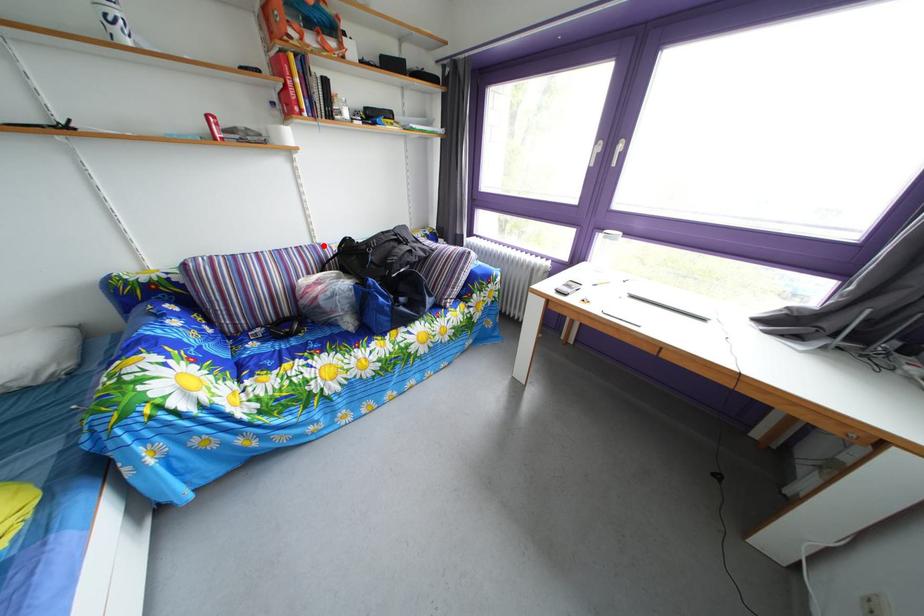
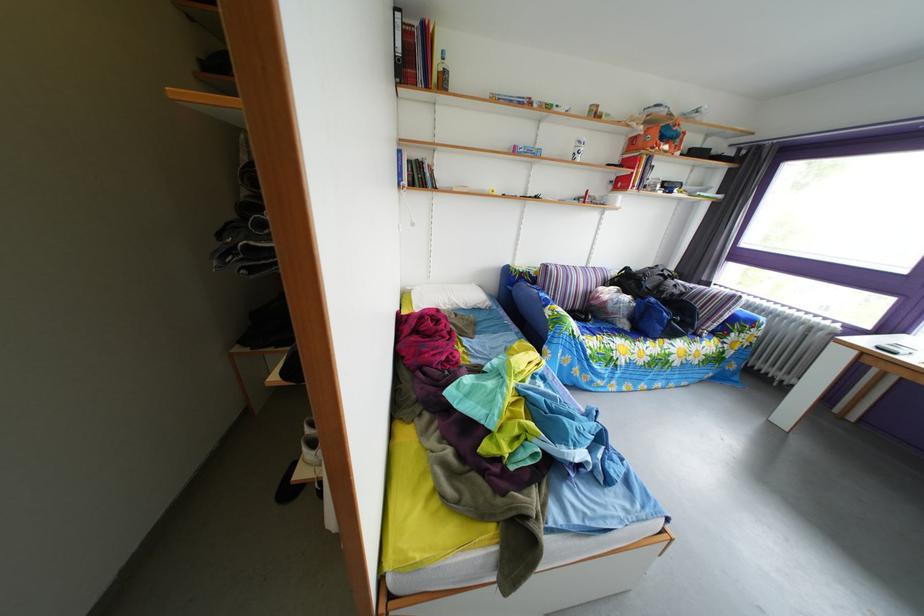
Question: A red point is marked in image1. In image2, is the corresponding 3D point closer to the camera or farther? Reply with the corresponding letter.

Choices:
 (A) The corresponding 3D point is closer.
 (B) The corresponding 3D point is farther.

Answer: (B)